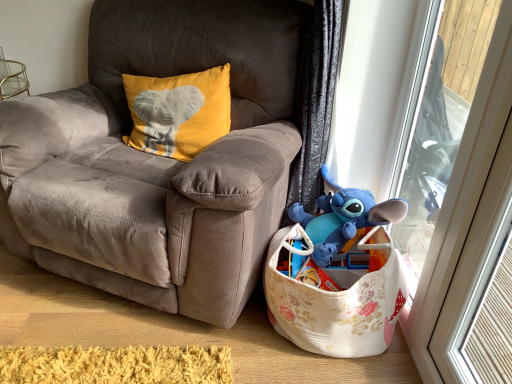
Question: From the image's perspective, relative to yellow soft fabric pillow with elephant design at upper left, is suede gray chair at center above or below?

Choices:
 (A) above
 (B) below

Answer: (B)

Question: Based on their positions, is suede gray chair at center located to the left or right of yellow soft fabric pillow with elephant design at upper left?

Choices:
 (A) right
 (B) left

Answer: (B)

Question: Estimate the real-world distances between objects in this image. Which object is farther from the transparent glass door at upper right?

Choices:
 (A) blue plush toy at lower right
 (B) floral fabric basket at lower right
 (C) yellow soft fabric pillow with elephant design at upper left
 (D) suede gray chair at center

Answer: (C)

Question: Estimate the real-world distances between objects in this image. Which object is closer to the yellow soft fabric pillow with elephant design at upper left?

Choices:
 (A) blue plush toy at lower right
 (B) floral fabric basket at lower right
 (C) transparent glass door at upper right
 (D) suede gray chair at center

Answer: (D)